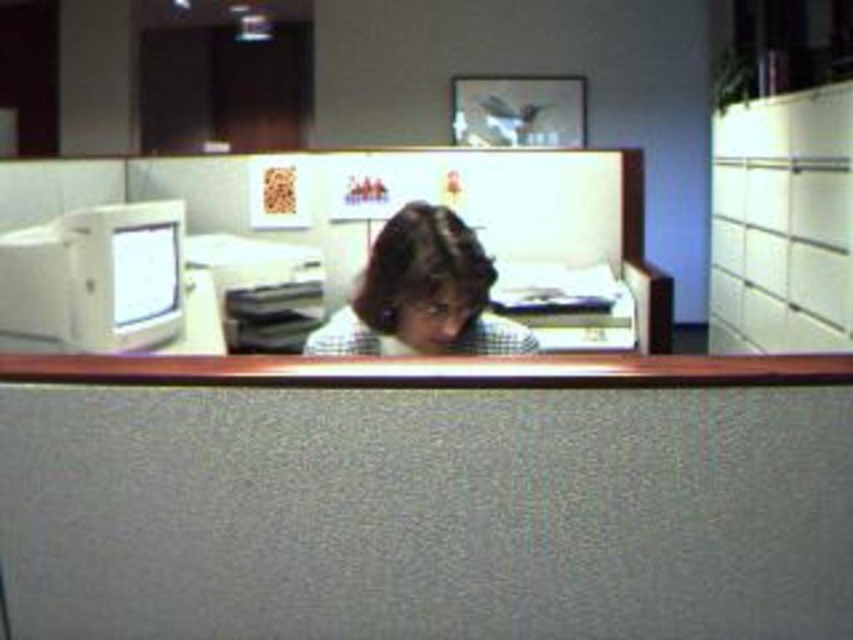
You are a delivery person who needs to place a small package between the matte white monitor at left and the white glossy monitor at left. Can you fit the package if it measures 2 inches in width?

The distance between the matte white monitor at left and the white glossy monitor at left is 1.89 inches. Since the package is 2 inches wide, it cannot fit between them as the gap is narrower than the package.

You are an office worker who needs to place a new document on the desk. Where exactly should you place it to ensure it is on the brown fabric table at center?

The brown fabric table at center is located at coordinates point (x=427, y=499), so placing the document there would ensure it is on the desk.

You are standing in the office and want to place a new plant on the desk. The desk is located at the coordinates specified by point (x=427, y=499). Can you confirm the exact location of the desk to ensure proper placement?

The point (x=427, y=499) marks the brown fabric table at center, so the desk is located at the center of the office.